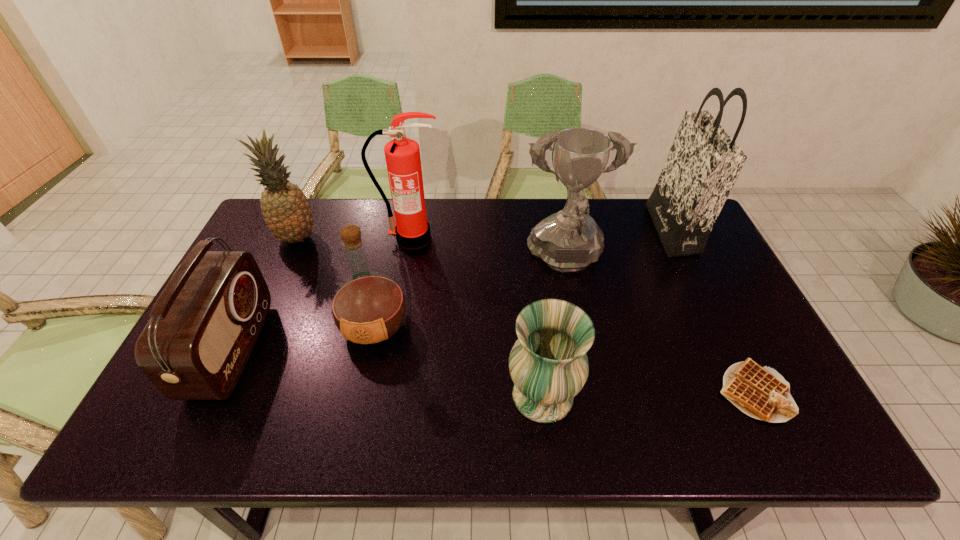
I want to click on shopping bag, so click(704, 162).

At what (x,y) coordinates should I click in order to perform the action: click on fire extinguisher. Please return your answer as a coordinate pair (x, y). This screenshot has width=960, height=540. Looking at the image, I should click on (412, 230).

This screenshot has height=540, width=960. In order to click on award in this screenshot , I will do `click(570, 240)`.

At what (x,y) coordinates should I click in order to perform the action: click on pineapple. Please return your answer as a coordinate pair (x, y). This screenshot has width=960, height=540. Looking at the image, I should click on (287, 213).

The image size is (960, 540). Find the location of `liquor`. liquor is located at coordinates (368, 308).

This screenshot has width=960, height=540. I want to click on radio receiver, so click(203, 327).

Identify the location of vase. Image resolution: width=960 pixels, height=540 pixels. [x=548, y=364].

The image size is (960, 540). In order to click on the shortest object in this screenshot , I will do `click(760, 392)`.

In order to click on vacant space located on the front of the shopping bag with the design in this screenshot , I will do `click(562, 230)`.

Locate an element on the screen. The height and width of the screenshot is (540, 960). free space located on the front of the shopping bag with the design is located at coordinates tap(597, 230).